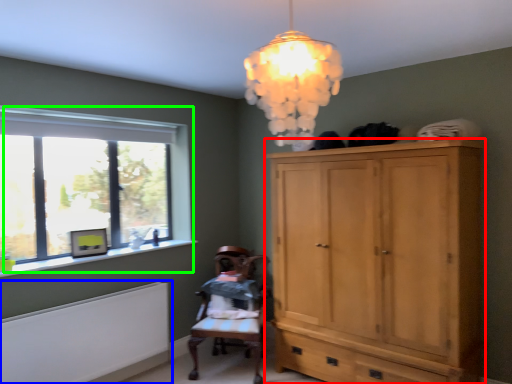
Question: Which object is positioned farthest from cabinetry (highlighted by a red box)? Select from radiator (highlighted by a blue box) and window (highlighted by a green box).

Choices:
 (A) radiator
 (B) window

Answer: (B)